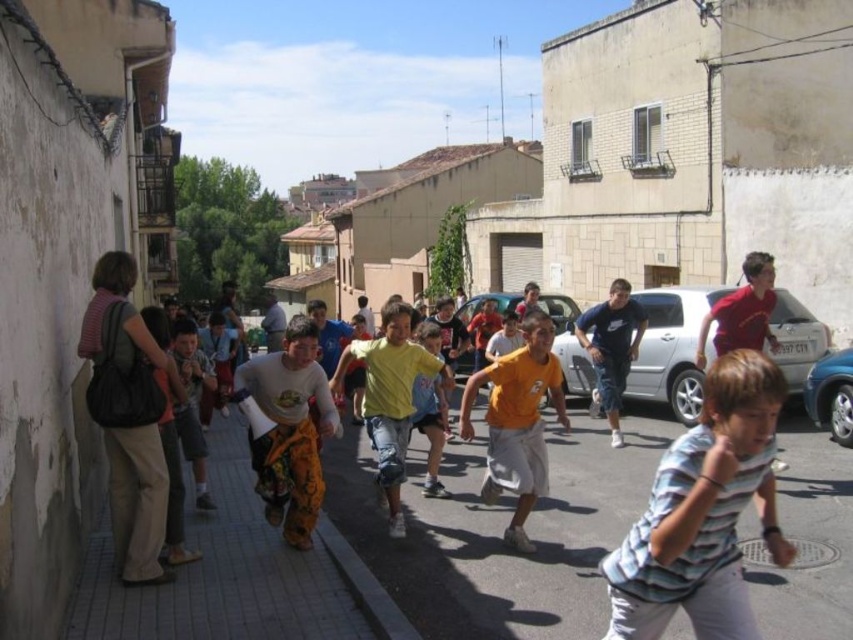
You are a photographer trying to capture a photo of the gray asphalt at center and the yellow cotton shirt at center. Which object should you focus on first if you want to ensure both are in the frame without moving the camera?

The gray asphalt at center is smaller than the yellow cotton shirt at center, so you should focus on the yellow cotton shirt at center first to ensure it fits in the frame since it takes up more space.

You are standing at point (500, 531) in the lively street scene. What material are you currently standing on?

The material at point (500, 531) is gray asphalt at center.

You are standing in the middle of the street and want to move towards the closest point between point (469, 576) and point (395, 342). Which point should you walk towards?

Point (469, 576) is closer to the viewer than point (395, 342), so you should walk towards point (469, 576).